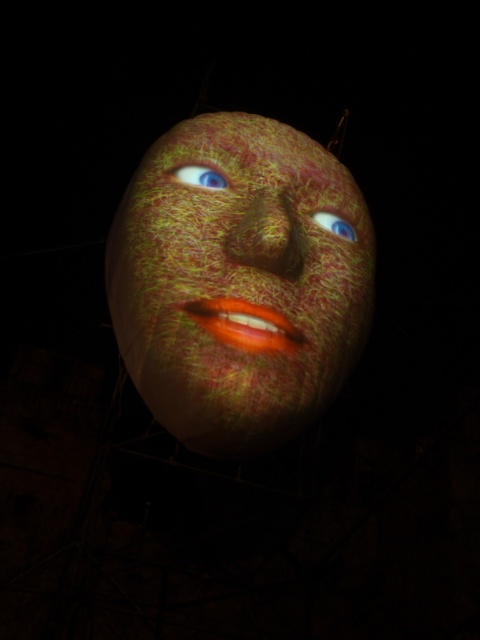
From the picture: Where is the speckled fabric mask at center located in the image?

The speckled fabric mask at center is located at point coordinates of (239,282).

Where is the speckled fabric mask at center located in the image?

The speckled fabric mask at center is located at point coordinates of [239,282].